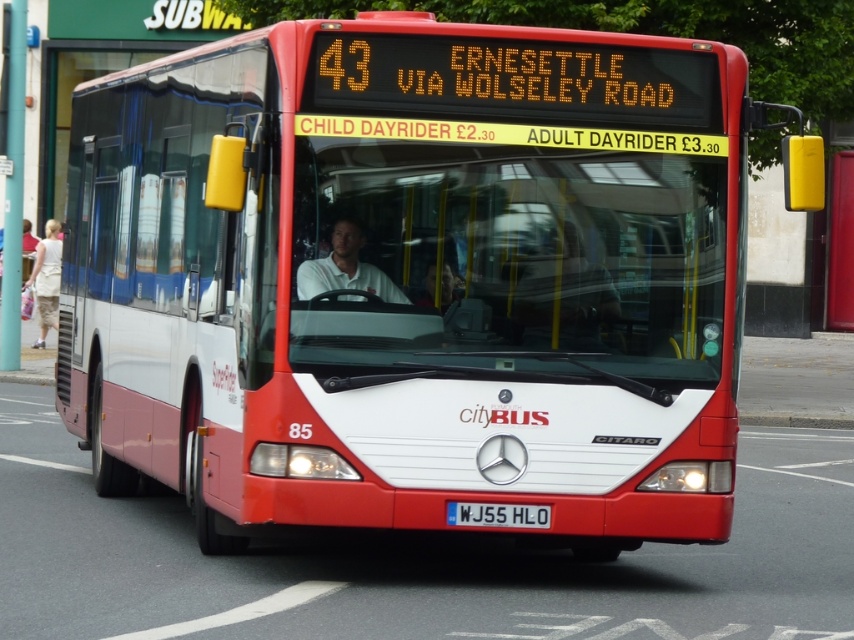
Question: Estimate the real-world distances between objects in this image. Which object is closer to the white matte shirt at center?

Choices:
 (A) white textured dress at lower left
 (B) white metallic license plate at center

Answer: (B)

Question: Does white matte shirt at center have a smaller size compared to white metallic license plate at center?

Choices:
 (A) no
 (B) yes

Answer: (A)

Question: Can you confirm if white matte shirt at center is positioned above white textured dress at lower left?

Choices:
 (A) no
 (B) yes

Answer: (A)

Question: Estimate the real-world distances between objects in this image. Which object is closer to the white textured dress at lower left?

Choices:
 (A) white metallic license plate at center
 (B) white matte shirt at center

Answer: (B)

Question: Is white matte shirt at center below white textured dress at lower left?

Choices:
 (A) yes
 (B) no

Answer: (A)

Question: Which object is closer to the camera taking this photo?

Choices:
 (A) white matte shirt at center
 (B) white metallic license plate at center

Answer: (A)